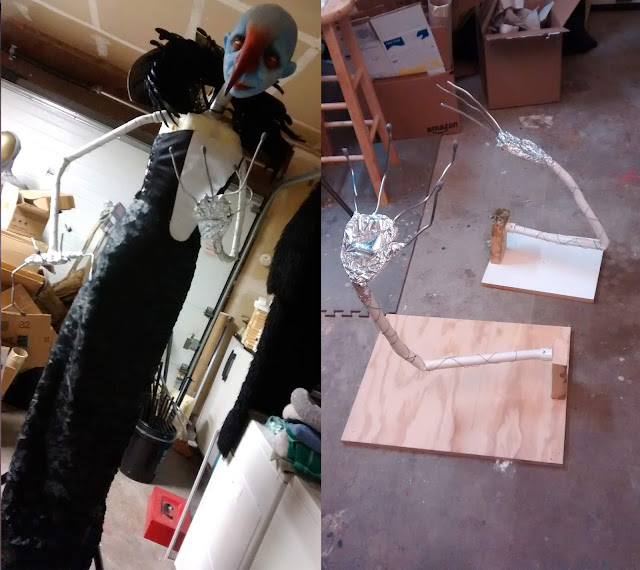
Identify the location of cardboard box. The image size is (640, 570). (534, 79).